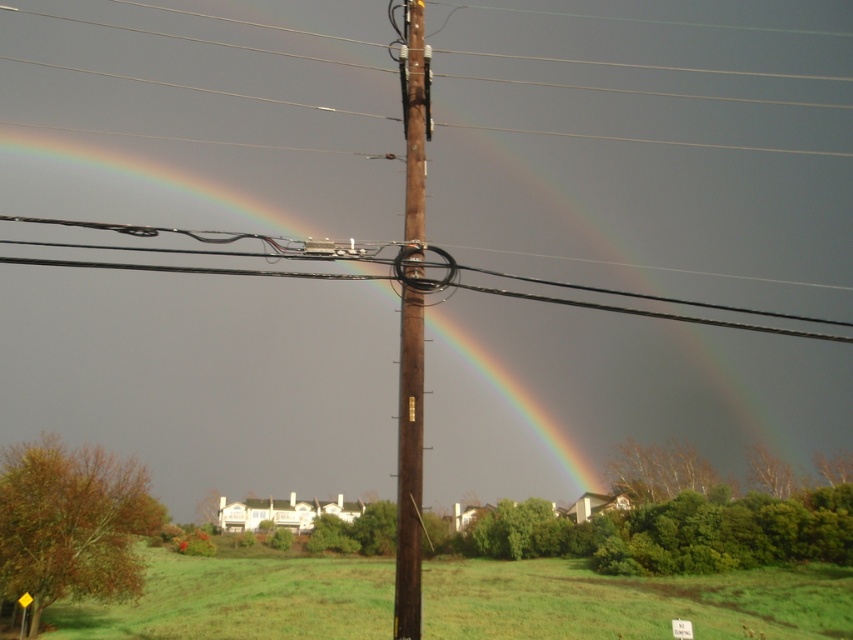
You are an electrician assessing the scene. You need to determine if the brown wooden telegraph pole at center can support the black wire at center based on their widths. Which object is narrower?

The brown wooden telegraph pole at center has a lesser width compared to the black wire at center, so the pole is narrower than the wire.

You are standing in the field looking at the brown wooden telegraph pole at center and the black wire at center. Which object is nearer to you?

The brown wooden telegraph pole at center is closer to the viewer than the black wire at center.